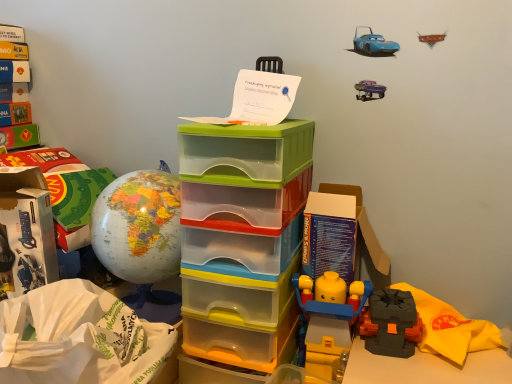
Question: Is translucent plastic storage box at center, arranged as the 1th storage box when viewed from the right, inside or outside of matte globe at left?

Choices:
 (A) outside
 (B) inside

Answer: (A)

Question: Relative to matte globe at left, is translucent plastic storage box at center, positioned as the 2th storage box in left-to-right order, in front or behind?

Choices:
 (A) behind
 (B) front

Answer: (B)

Question: Estimate the real-world distances between objects in this image. Which object is closer to the white paper bag at lower left?

Choices:
 (A) white cardboard box at left, which is the first storage box from left to right
 (B) matte black lego piece at lower right
 (C) matte globe at left
 (D) translucent plastic storage box at center, arranged as the 1th storage box when viewed from the right

Answer: (C)

Question: Estimate the real-world distances between objects in this image. Which object is farther from the white paper bag at lower left?

Choices:
 (A) matte globe at left
 (B) translucent plastic storage box at center, arranged as the 1th storage box when viewed from the right
 (C) white cardboard box at left, marked as the second storage box in a right-to-left arrangement
 (D) matte black lego piece at lower right

Answer: (D)